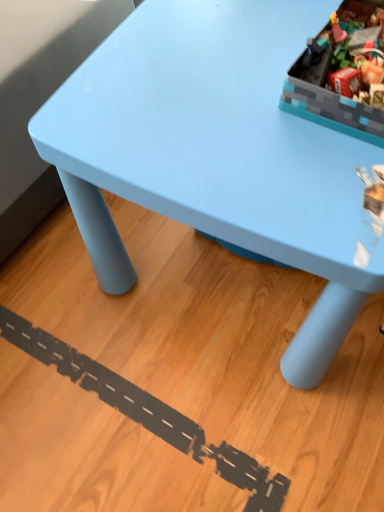
What do you see at coordinates (218, 154) in the screenshot?
I see `light blue plastic table at upper center` at bounding box center [218, 154].

Find the location of a particular element. light blue plastic table at upper center is located at coordinates (218, 154).

What is the approximate height of light blue plastic table at upper center?

19.39 inches.

In order to face light blue plastic table at upper center, should I rotate leftwards or rightwards?

Rotate your view right by about 11.803°.

The width and height of the screenshot is (384, 512). What do you see at coordinates (341, 76) in the screenshot?
I see `matte plastic storage box at upper right` at bounding box center [341, 76].

At what (x,y) coordinates should I click in order to perform the action: click on matte plastic storage box at upper right. Please return your answer as a coordinate pair (x, y). The width and height of the screenshot is (384, 512). Looking at the image, I should click on (341, 76).

The width and height of the screenshot is (384, 512). Find the location of `light blue plastic table at upper center`. light blue plastic table at upper center is located at coordinates (218, 154).

Would you say light blue plastic table at upper center is to the left or to the right of matte plastic storage box at upper right in the picture?

Clearly, light blue plastic table at upper center is on the left of matte plastic storage box at upper right in the image.

Is the depth of light blue plastic table at upper center less than that of matte plastic storage box at upper right?

Yes.

Between point (193, 220) and point (379, 3), which one is positioned in front?

The point (193, 220) is more forward.

From the picture: From the image's perspective, who appears lower, light blue plastic table at upper center or matte plastic storage box at upper right?

light blue plastic table at upper center appears lower in the image.

From a real-world perspective, is light blue plastic table at upper center positioned over matte plastic storage box at upper right based on gravity?

No, from a real-world perspective, light blue plastic table at upper center is not above matte plastic storage box at upper right.

Considering the sizes of light blue plastic table at upper center and matte plastic storage box at upper right in the image, is light blue plastic table at upper center wider or thinner than matte plastic storage box at upper right?

In the image, light blue plastic table at upper center appears to be wider than matte plastic storage box at upper right.

Between light blue plastic table at upper center and matte plastic storage box at upper right, which one has less height?

Standing shorter between the two is matte plastic storage box at upper right.

Considering the relative sizes of light blue plastic table at upper center and matte plastic storage box at upper right in the image provided, is light blue plastic table at upper center smaller than matte plastic storage box at upper right?

No, light blue plastic table at upper center is not smaller than matte plastic storage box at upper right.

Is matte plastic storage box at upper right completely or partially inside light blue plastic table at upper center?

No, matte plastic storage box at upper right is located outside of light blue plastic table at upper center.

Is light blue plastic table at upper center placed right next to matte plastic storage box at upper right?

light blue plastic table at upper center is not next to matte plastic storage box at upper right, and they're not touching.

Is light blue plastic table at upper center facing away from matte plastic storage box at upper right?

No, light blue plastic table at upper center is not facing the opposite direction of matte plastic storage box at upper right.

Consider the image. How many degrees apart are the facing directions of light blue plastic table at upper center and matte plastic storage box at upper right?

The angle between the facing direction of light blue plastic table at upper center and the facing direction of matte plastic storage box at upper right is 3.81 degrees.

Find the location of `storage box above the light blue plastic table at upper center (from a real-world perspective)`. storage box above the light blue plastic table at upper center (from a real-world perspective) is located at coordinates (341, 76).

Is matte plastic storage box at upper right to the right of light blue plastic table at upper center from the viewer's perspective?

Indeed, matte plastic storage box at upper right is positioned on the right side of light blue plastic table at upper center.

Is matte plastic storage box at upper right closer to camera compared to light blue plastic table at upper center?

A: No, the depth of matte plastic storage box at upper right is greater than that of light blue plastic table at upper center.

Considering the positions of points (354, 15) and (243, 151), is point (354, 15) closer to camera compared to point (243, 151)?

No, (354, 15) is behind (243, 151).

In the scene shown: From the image's perspective, does matte plastic storage box at upper right appear lower than light blue plastic table at upper center?

Incorrect, from the image's perspective, matte plastic storage box at upper right is higher than light blue plastic table at upper center.

Looking at this image, from a real-world perspective, is matte plastic storage box at upper right on light blue plastic table at upper center?

Indeed, from a real-world perspective, matte plastic storage box at upper right stands above light blue plastic table at upper center.

Considering the sizes of objects matte plastic storage box at upper right and light blue plastic table at upper center in the image provided, who is thinner, matte plastic storage box at upper right or light blue plastic table at upper center?

Thinner between the two is matte plastic storage box at upper right.

Considering the sizes of objects matte plastic storage box at upper right and light blue plastic table at upper center in the image provided, who is shorter, matte plastic storage box at upper right or light blue plastic table at upper center?

Standing shorter between the two is matte plastic storage box at upper right.

Between matte plastic storage box at upper right and light blue plastic table at upper center, which one has larger size?

light blue plastic table at upper center is bigger.

Would you say matte plastic storage box at upper right is outside light blue plastic table at upper center?

Yes, matte plastic storage box at upper right is outside of light blue plastic table at upper center.

Can you see matte plastic storage box at upper right touching light blue plastic table at upper center?

No, matte plastic storage box at upper right is not touching light blue plastic table at upper center.

Is light blue plastic table at upper center at the back of matte plastic storage box at upper right?

No.

Based on the photo, can you tell me how much matte plastic storage box at upper right and light blue plastic table at upper center differ in facing direction?

The angular difference between matte plastic storage box at upper right and light blue plastic table at upper center is 3.81 degrees.

Could you measure the distance between matte plastic storage box at upper right and light blue plastic table at upper center?

They are 18.11 centimeters apart.

Where is `storage box on the right side of light blue plastic table at upper center`? storage box on the right side of light blue plastic table at upper center is located at coordinates point(341,76).

The width and height of the screenshot is (384, 512). Find the location of `storage box above the light blue plastic table at upper center (from a real-world perspective)`. storage box above the light blue plastic table at upper center (from a real-world perspective) is located at coordinates coord(341,76).

Identify the location of table below the matte plastic storage box at upper right (from the image's perspective). This screenshot has height=512, width=384. (218, 154).